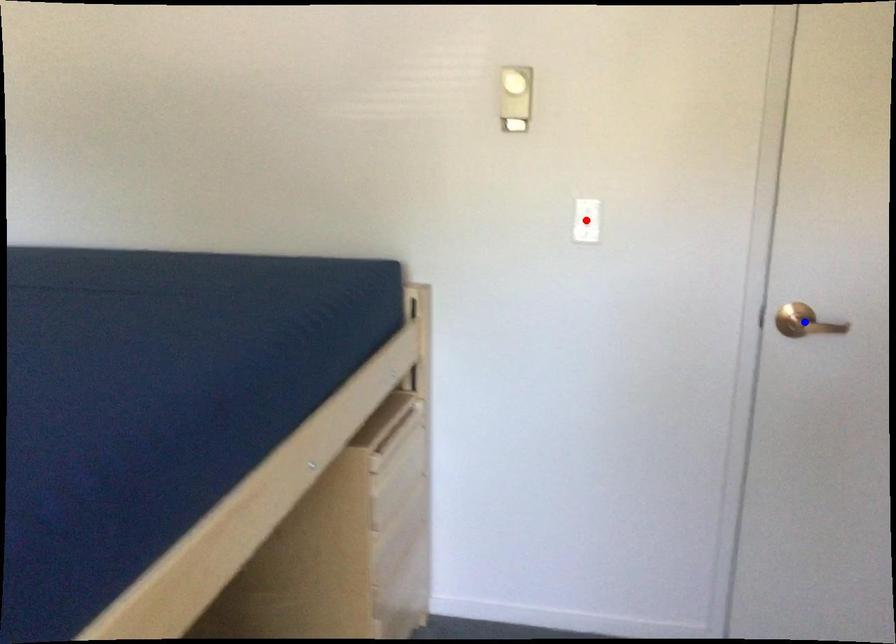
Question: Which of the two points in the image is closer to the camera?

Choices:
 (A) Blue point is closer.
 (B) Red point is closer.

Answer: (A)